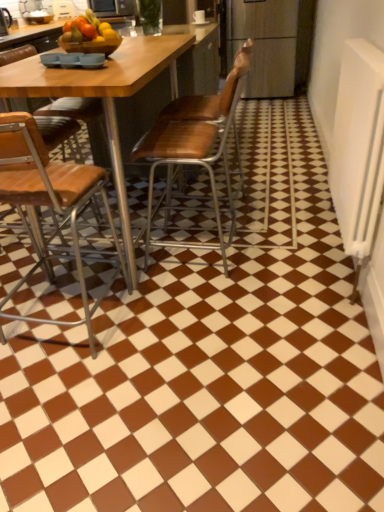
What are the coordinates of `free space in front of wooden at center, which ranks as the second chair in left-to-right order` in the screenshot? It's located at (222, 304).